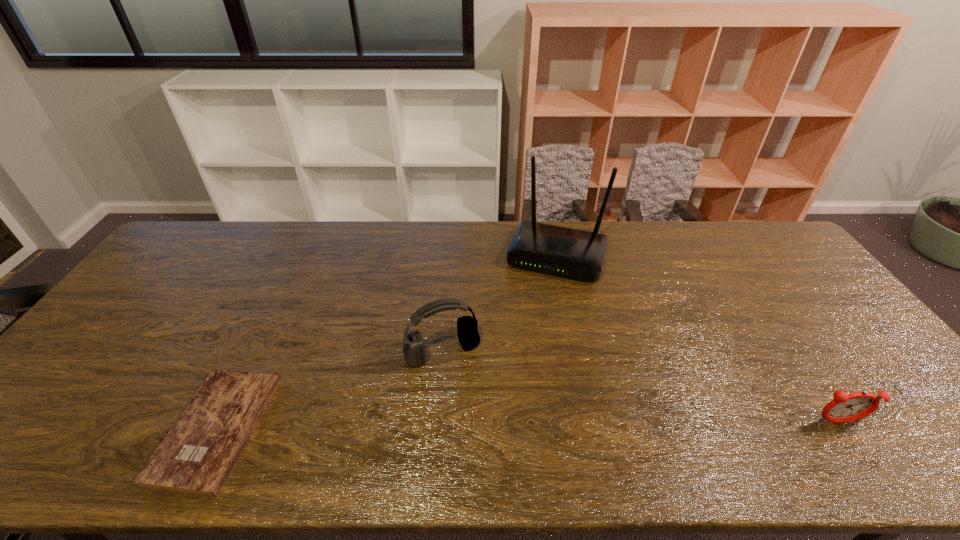
You are a GUI agent. You are given a task and a screenshot of the screen. Output one action in this format:
    pyautogui.click(x=<x>, y=<y>)
    Task: Click on the object that is the third closest one to the shortest object
    
    Given the screenshot: What is the action you would take?
    pyautogui.click(x=845, y=408)

Where is `object that is the second closest one to the alarm clock`? object that is the second closest one to the alarm clock is located at coordinates (467, 327).

The height and width of the screenshot is (540, 960). I want to click on vacant space that satisfies the following two spatial constraints: 1. on the back side of the second object from left to right; 2. on the right side of the tallest object, so click(x=450, y=255).

Identify the location of vacant space that satisfies the following two spatial constraints: 1. on the back side of the router; 2. on the left side of the third shortest object. (450, 255).

Find the location of a particular element. vacant space that satisfies the following two spatial constraints: 1. on the back side of the third shortest object; 2. on the right side of the second object from right to left is located at coordinates (450, 255).